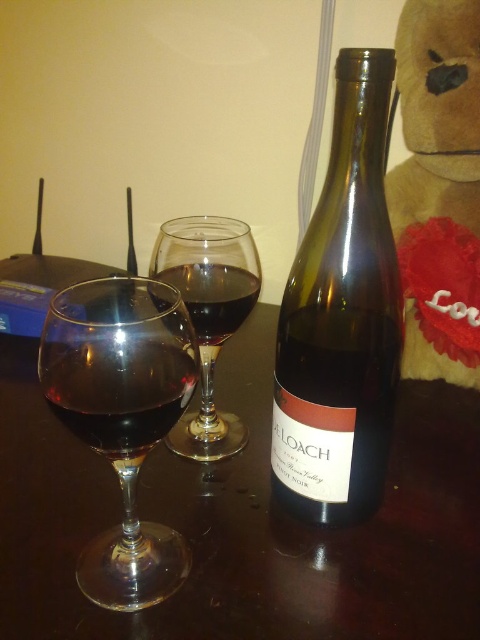
Question: From the image, what is the correct spatial relationship of shiny dark glass at center in relation to dark glass at center?

Choices:
 (A) below
 (B) above

Answer: (A)

Question: Which point is closer to the camera?

Choices:
 (A) (422, 296)
 (B) (131, 440)
 (C) (227, 304)

Answer: (B)

Question: Among these points, which one is nearest to the camera?

Choices:
 (A) (52, 312)
 (B) (443, 236)
 (C) (26, 340)
 (D) (210, 307)

Answer: (A)

Question: Does shiny dark glass at center come in front of dark glass at center?

Choices:
 (A) yes
 (B) no

Answer: (A)

Question: Among these points, which one is nearest to the camera?

Choices:
 (A) (284, 483)
 (B) (217, 253)
 (C) (122, 369)

Answer: (C)

Question: Can you confirm if brown plush toy at upper right is positioned above dark glass at center?

Choices:
 (A) no
 (B) yes

Answer: (B)